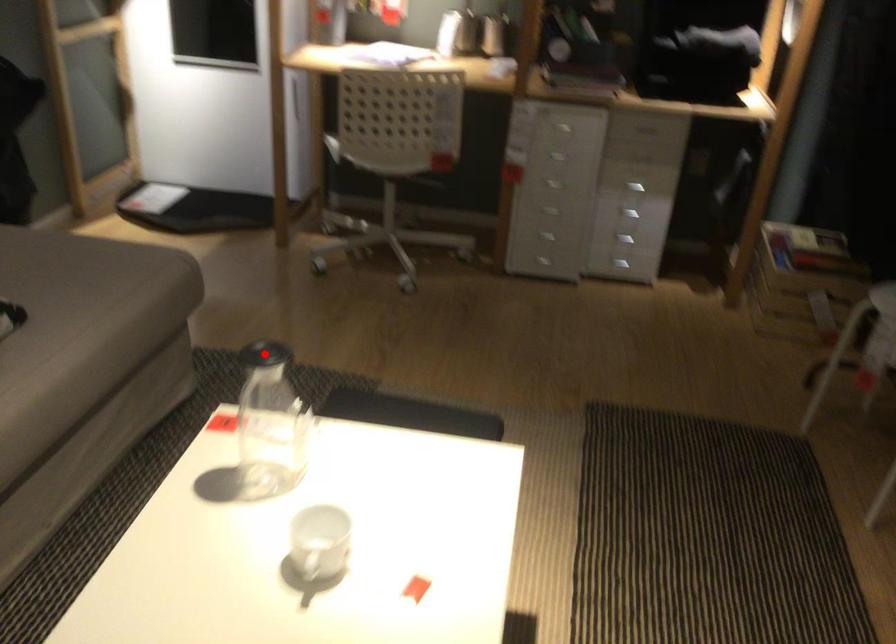
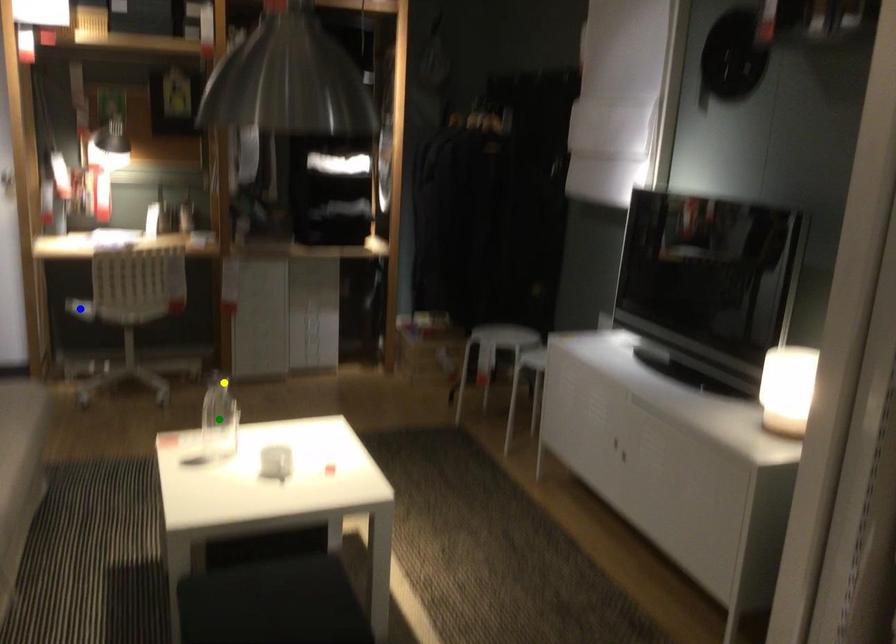
Question: I am providing you with two images of the same scene from different viewpoints. A red point is marked on the first image. You are given multiple points on the second image. Which point in image 2 is actually the same real-world point as the red point in image 1?

Choices:
 (A) yellow point
 (B) blue point
 (C) green point

Answer: (A)